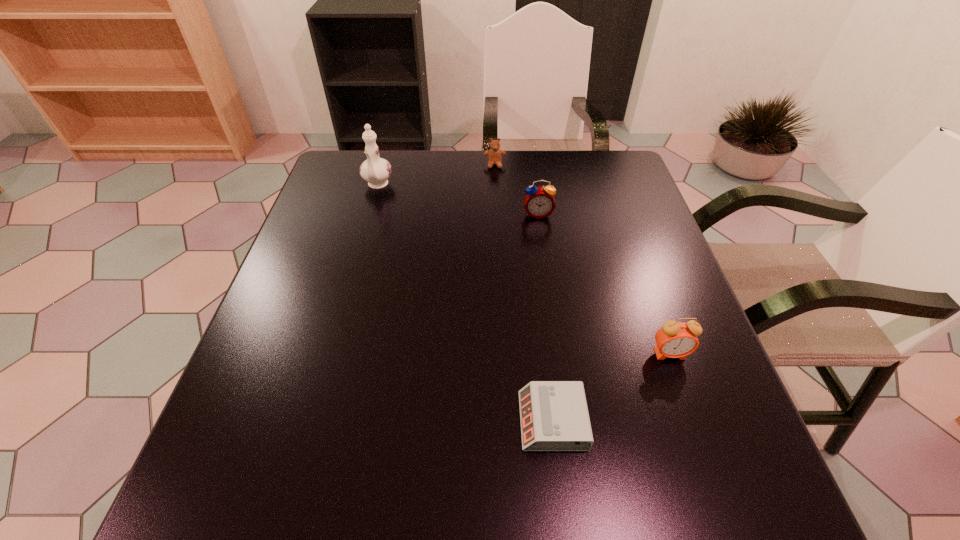
The width and height of the screenshot is (960, 540). I want to click on the fourth nearest object, so click(x=375, y=170).

You are a GUI agent. You are given a task and a screenshot of the screen. Output one action in this format:
    pyautogui.click(x=<x>, y=<y>)
    Task: Click on the leftmost object
    
    Given the screenshot: What is the action you would take?
    pyautogui.click(x=375, y=170)

At what (x,y) coordinates should I click in order to perform the action: click on the third nearest object. Please return your answer as a coordinate pair (x, y). The width and height of the screenshot is (960, 540). Looking at the image, I should click on (539, 202).

You are a GUI agent. You are given a task and a screenshot of the screen. Output one action in this format:
    pyautogui.click(x=<x>, y=<y>)
    Task: Click on the rightmost alarm clock
    The height and width of the screenshot is (540, 960).
    Given the screenshot: What is the action you would take?
    pyautogui.click(x=675, y=339)

The height and width of the screenshot is (540, 960). Identify the location of the fourth farthest object. (675, 339).

Identify the location of the farthest object. (494, 154).

Find the location of a particular element. teddy bear is located at coordinates (494, 154).

You are a GUI agent. You are given a task and a screenshot of the screen. Output one action in this format:
    pyautogui.click(x=<x>, y=<y>)
    Task: Click on the nearest object
    
    Given the screenshot: What is the action you would take?
    pyautogui.click(x=554, y=416)

Where is `the nearest alarm clock`? Image resolution: width=960 pixels, height=540 pixels. the nearest alarm clock is located at coordinates (554, 416).

Where is `free space located at the spout of the chinaware`? This screenshot has width=960, height=540. free space located at the spout of the chinaware is located at coordinates (369, 218).